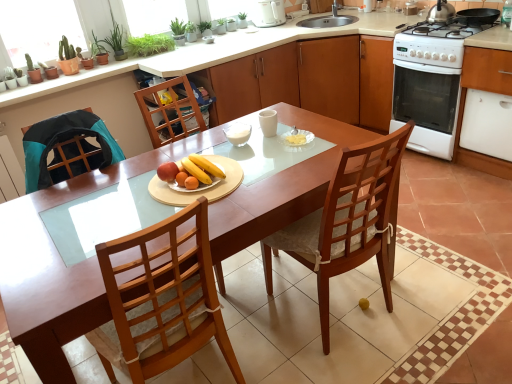
Where is `vacant area located to the right-hand side of smooth wooden plate with fruits at center, the second fruit dish from the right`? Image resolution: width=512 pixels, height=384 pixels. vacant area located to the right-hand side of smooth wooden plate with fruits at center, the second fruit dish from the right is located at coordinates click(278, 167).